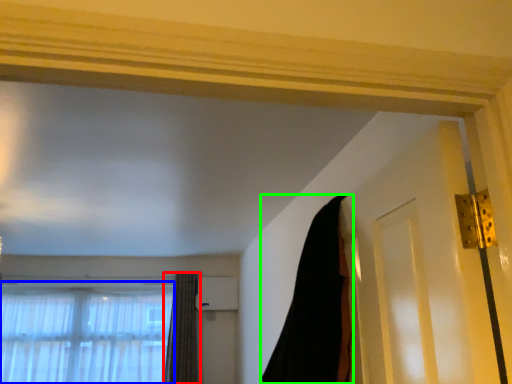
Question: Which object is positioned closest to curtain (highlighted by a red box)? Select from window (highlighted by a blue box) and curtain (highlighted by a green box).

Choices:
 (A) window
 (B) curtain

Answer: (A)